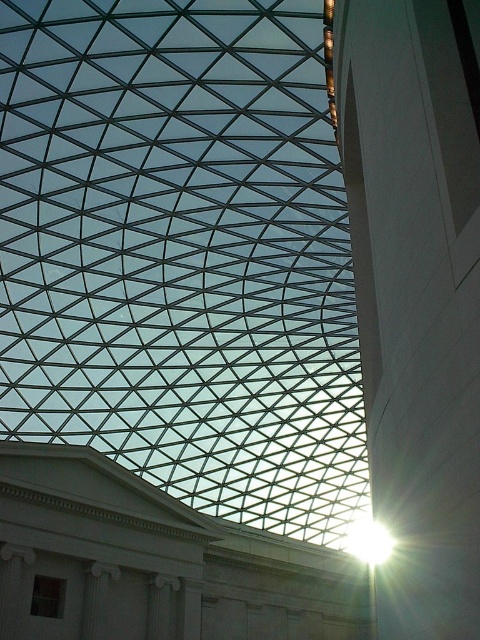
Question: Which of the following is the closest to the observer?

Choices:
 (A) transparent glass roof at center
 (B) white glossy pillar at right

Answer: (B)

Question: Does transparent glass roof at center appear over white glossy pillar at right?

Choices:
 (A) no
 (B) yes

Answer: (A)

Question: Observing the image, what is the correct spatial positioning of transparent glass roof at center in reference to white glossy pillar at right?

Choices:
 (A) above
 (B) below

Answer: (B)

Question: Is transparent glass roof at center wider than white glossy pillar at right?

Choices:
 (A) no
 (B) yes

Answer: (B)